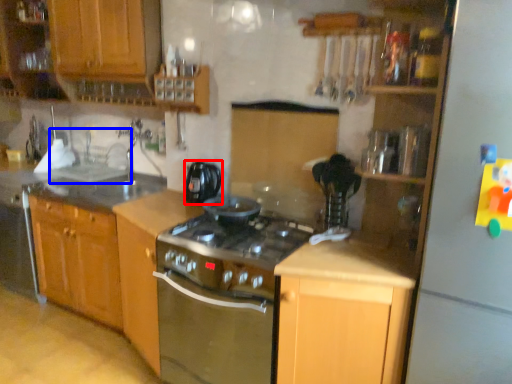
Question: Among these objects, which one is farthest to the camera, kitchen appliance (highlighted by a red box) or sink (highlighted by a blue box)?

Choices:
 (A) kitchen appliance
 (B) sink

Answer: (B)